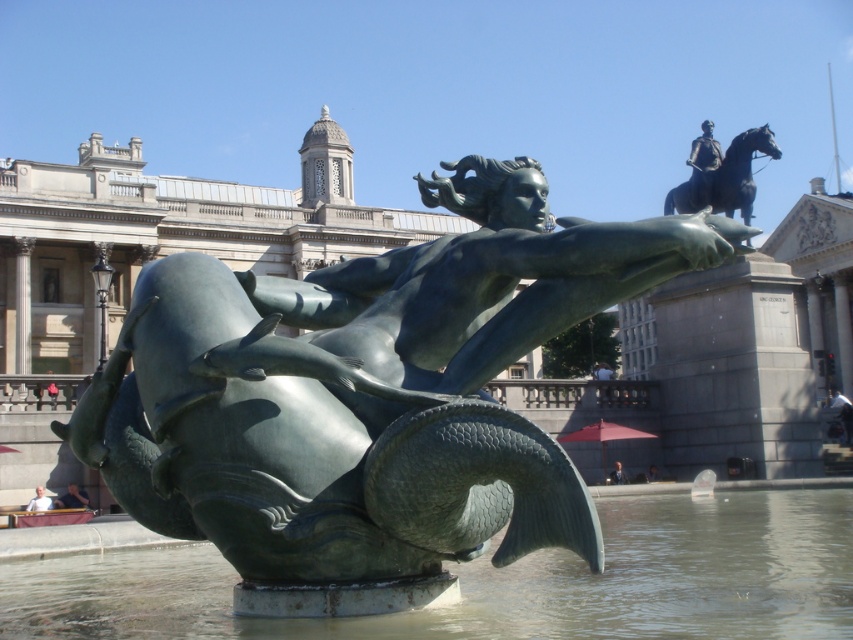
Does green polished bronze mermaid at center have a greater height compared to polished bronze statue at upper right?

Correct, green polished bronze mermaid at center is much taller as polished bronze statue at upper right.

Who is shorter, green polished bronze mermaid at center or polished bronze statue at upper right?

polished bronze statue at upper right

The height and width of the screenshot is (640, 853). What do you see at coordinates (368, 397) in the screenshot? I see `green polished bronze mermaid at center` at bounding box center [368, 397].

Where is `green polished bronze mermaid at center`? Image resolution: width=853 pixels, height=640 pixels. green polished bronze mermaid at center is located at coordinates point(368,397).

Is point (289, 353) closer to viewer compared to point (759, 627)?

Yes.

Which is in front, point (428, 184) or point (254, 634)?

Point (254, 634) is in front.

This screenshot has height=640, width=853. Describe the element at coordinates (368, 397) in the screenshot. I see `green polished bronze mermaid at center` at that location.

Locate an element on the screen. green polished bronze mermaid at center is located at coordinates (368, 397).

Can you confirm if greenish water at center is positioned to the right of polished bronze statue at upper right?

Incorrect, greenish water at center is not on the right side of polished bronze statue at upper right.

You are a GUI agent. You are given a task and a screenshot of the screen. Output one action in this format:
    pyautogui.click(x=<x>, y=<y>)
    Task: Click on the greenish water at center
    
    Given the screenshot: What is the action you would take?
    pyautogui.click(x=505, y=582)

This screenshot has width=853, height=640. I want to click on greenish water at center, so click(505, 582).